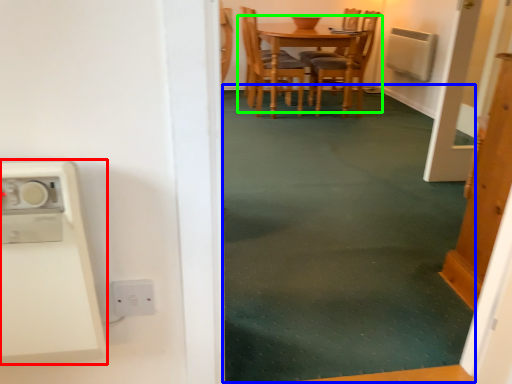
Question: Considering the real-world distances, which object is closest to appliance (highlighted by a red box)? plain (highlighted by a blue box) or kitchen & dining room table (highlighted by a green box).

Choices:
 (A) plain
 (B) kitchen & dining room table

Answer: (A)